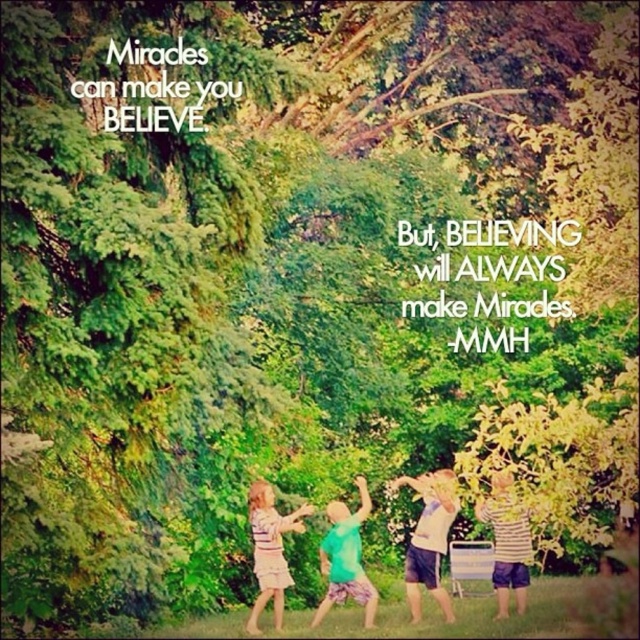
Between striped cotton shirt at lower right and striped fabric dress at lower left, which one is positioned higher?

striped cotton shirt at lower right is above.

Is striped cotton shirt at lower right above striped fabric dress at lower left?

Yes, striped cotton shirt at lower right is above striped fabric dress at lower left.

Describe the element at coordinates (506, 541) in the screenshot. I see `striped cotton shirt at lower right` at that location.

You are a GUI agent. You are given a task and a screenshot of the screen. Output one action in this format:
    pyautogui.click(x=<x>, y=<y>)
    Task: Click on the striped cotton shirt at lower right
    The height and width of the screenshot is (640, 640).
    Given the screenshot: What is the action you would take?
    pyautogui.click(x=506, y=541)

Who is positioned more to the left, white cotton shirt at center or green matte shirt at center?

Positioned to the left is green matte shirt at center.

Can you confirm if white cotton shirt at center is positioned to the right of green matte shirt at center?

Yes, white cotton shirt at center is to the right of green matte shirt at center.

What do you see at coordinates (429, 538) in the screenshot? The image size is (640, 640). I see `white cotton shirt at center` at bounding box center [429, 538].

Where is `white cotton shirt at center`? white cotton shirt at center is located at coordinates (429, 538).

How far apart are white cotton shirt at center and striped fabric dress at lower left?

white cotton shirt at center is 3.28 meters away from striped fabric dress at lower left.

Is point (428, 476) more distant than point (259, 564)?

Yes, it is behind point (259, 564).

Where is `white cotton shirt at center`? white cotton shirt at center is located at coordinates click(x=429, y=538).